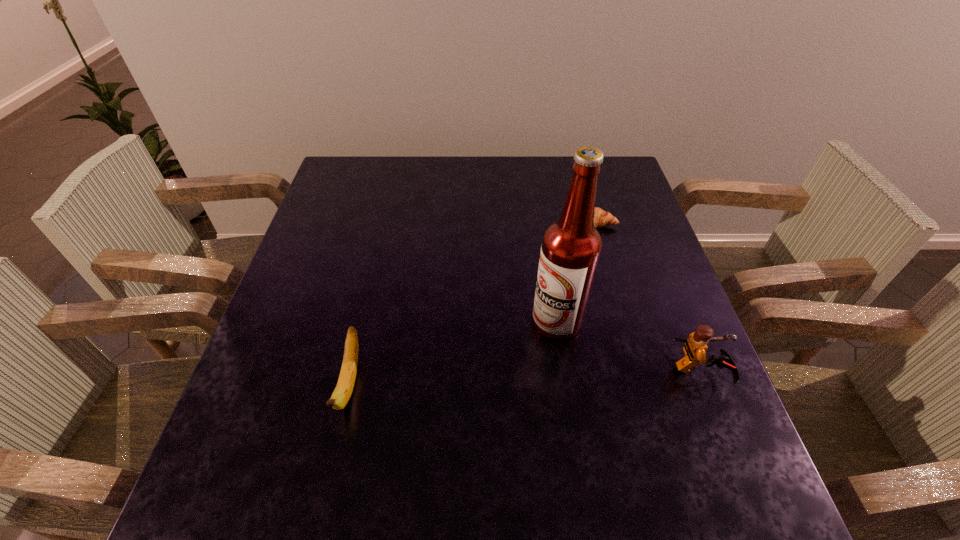
This screenshot has height=540, width=960. Find the location of `the leftmost object`. the leftmost object is located at coordinates (344, 388).

The width and height of the screenshot is (960, 540). Identify the location of banana. (344, 388).

Find the location of a particular element. The image size is (960, 540). the rightmost object is located at coordinates (695, 347).

You are a GUI agent. You are given a task and a screenshot of the screen. Output one action in this format:
    pyautogui.click(x=<x>, y=<y>)
    Task: Click on the Lego
    Image resolution: width=960 pixels, height=540 pixels.
    Given the screenshot: What is the action you would take?
    pyautogui.click(x=695, y=347)

I want to click on pastry, so click(601, 218).

Image resolution: width=960 pixels, height=540 pixels. Identify the location of the third object from left to right. (601, 218).

The image size is (960, 540). I want to click on alcohol, so click(571, 247).

Find the location of `the third object from right to left`. the third object from right to left is located at coordinates (571, 247).

Locate an element on the screen. free space located 0.280m on the front-facing side of the pastry is located at coordinates (575, 304).

The width and height of the screenshot is (960, 540). What are the coordinates of `vacant space located on the front-facing side of the pastry` in the screenshot? It's located at (571, 324).